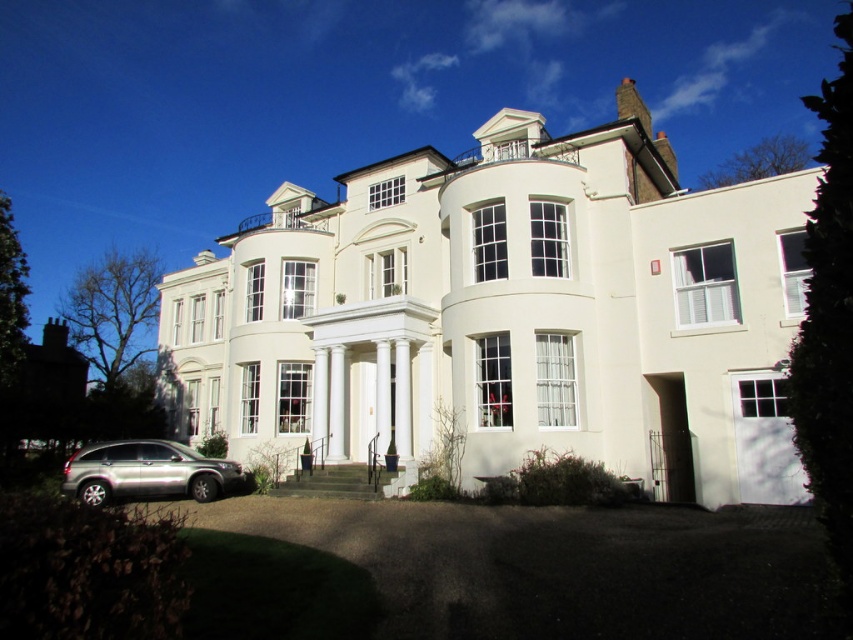
Question: Can you confirm if white glossy mansion at center is bigger than dark asphalt driveway at lower center?

Choices:
 (A) yes
 (B) no

Answer: (A)

Question: Which point is farther from the camera taking this photo?

Choices:
 (A) (459, 172)
 (B) (202, 577)

Answer: (A)

Question: Does white glossy mansion at center appear on the right side of dark asphalt driveway at lower center?

Choices:
 (A) no
 (B) yes

Answer: (B)

Question: Which point is farther to the camera?

Choices:
 (A) (775, 328)
 (B) (163, 483)
 (C) (747, 604)

Answer: (B)

Question: Does white glossy mansion at center appear on the right side of dark asphalt driveway at lower center?

Choices:
 (A) yes
 (B) no

Answer: (A)

Question: Estimate the real-world distances between objects in this image. Which object is farther from the white glossy mansion at center?

Choices:
 (A) silver metallic suv at lower left
 (B) dark asphalt driveway at lower center

Answer: (A)